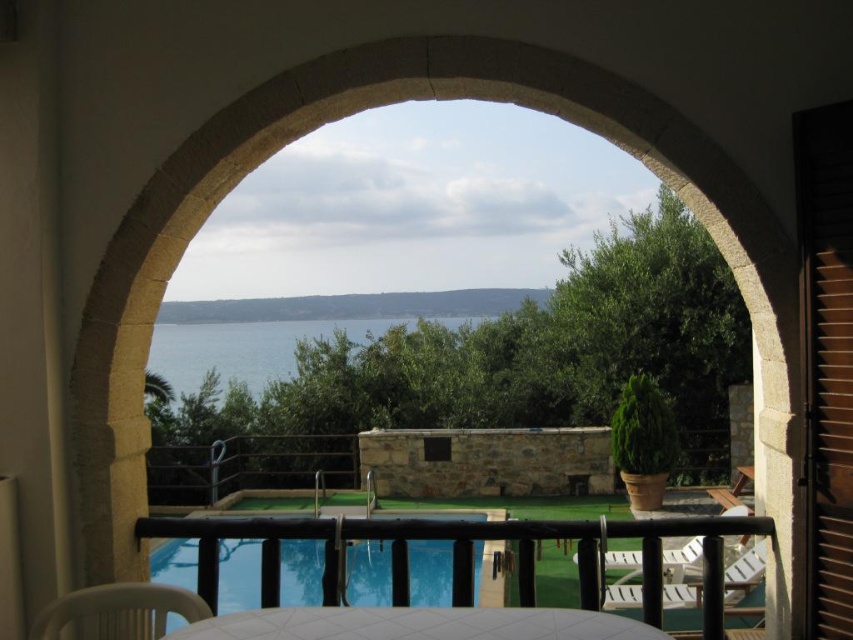
Question: Which point is farther to the camera?

Choices:
 (A) (236, 328)
 (B) (148, 586)
 (C) (317, 637)

Answer: (A)

Question: Estimate the real-world distances between objects in this image. Which object is farther from the white plastic chair at lower right?

Choices:
 (A) white plastic chair at lower left
 (B) white glossy table at center
 (C) transparent glass pool at center
 (D) blue water at center

Answer: (D)

Question: Is transparent glass pool at center further to camera compared to white plastic chair at lower left?

Choices:
 (A) no
 (B) yes

Answer: (B)

Question: Can you confirm if blue water at center is thinner than white plastic chair at lower right?

Choices:
 (A) no
 (B) yes

Answer: (B)

Question: Can you confirm if transparent glass pool at center is positioned to the left of blue water at center?

Choices:
 (A) no
 (B) yes

Answer: (B)

Question: Among these points, which one is nearest to the camera?

Choices:
 (A) (654, 634)
 (B) (329, 340)

Answer: (A)